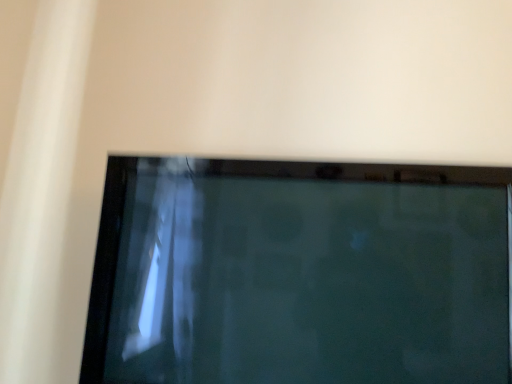
Measure the distance between point [111,328] and camera.

A distance of 4.06 feet exists between point [111,328] and camera.

The width and height of the screenshot is (512, 384). What do you see at coordinates (298, 274) in the screenshot?
I see `matte black tv at center` at bounding box center [298, 274].

Locate an element on the screen. This screenshot has width=512, height=384. matte black tv at center is located at coordinates (298, 274).

The height and width of the screenshot is (384, 512). In order to click on matte black tv at center in this screenshot , I will do `click(298, 274)`.